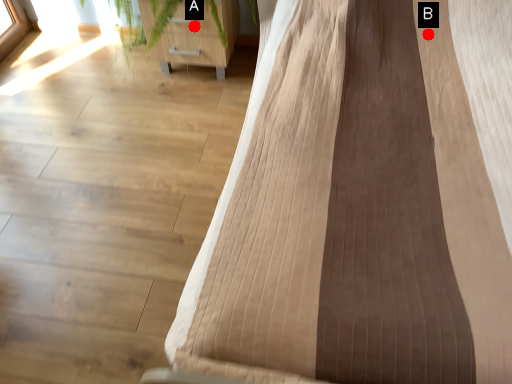
Question: Two points are circled on the image, labeled by A and B beside each circle. Among these points, which one is farthest from the camera?

Choices:
 (A) A is further
 (B) B is further

Answer: (A)